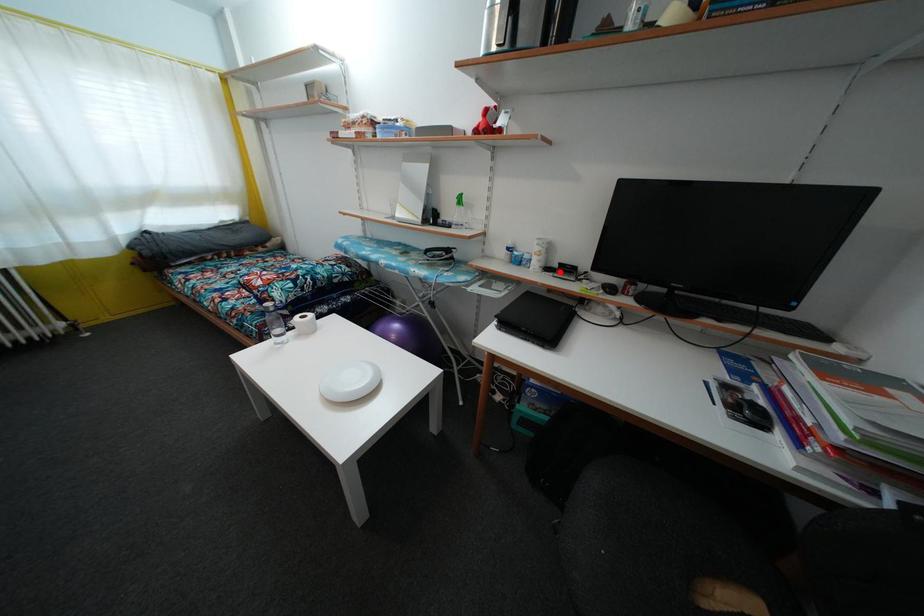
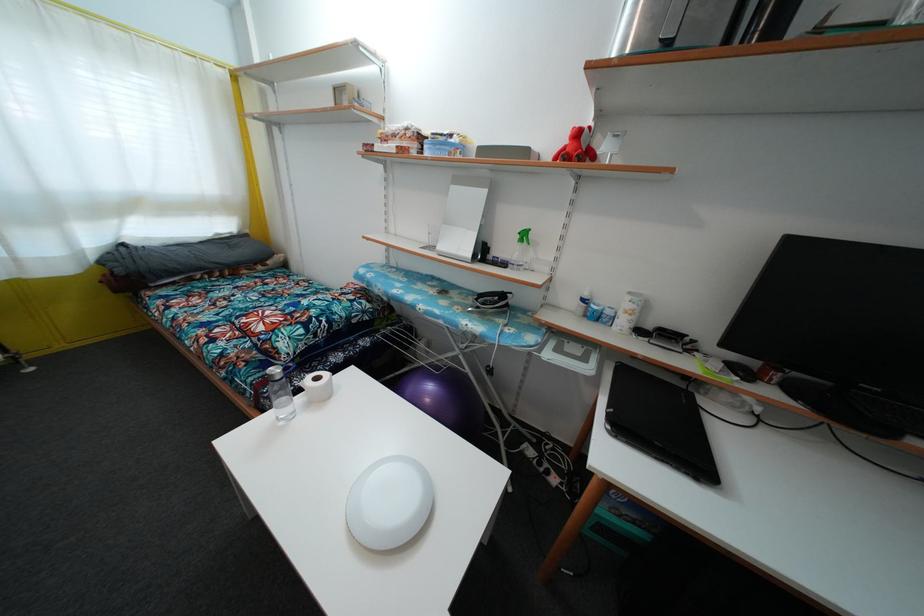
The point at the highlighted location is marked in the first image. Where is the corresponding point in the second image?

(652, 334)